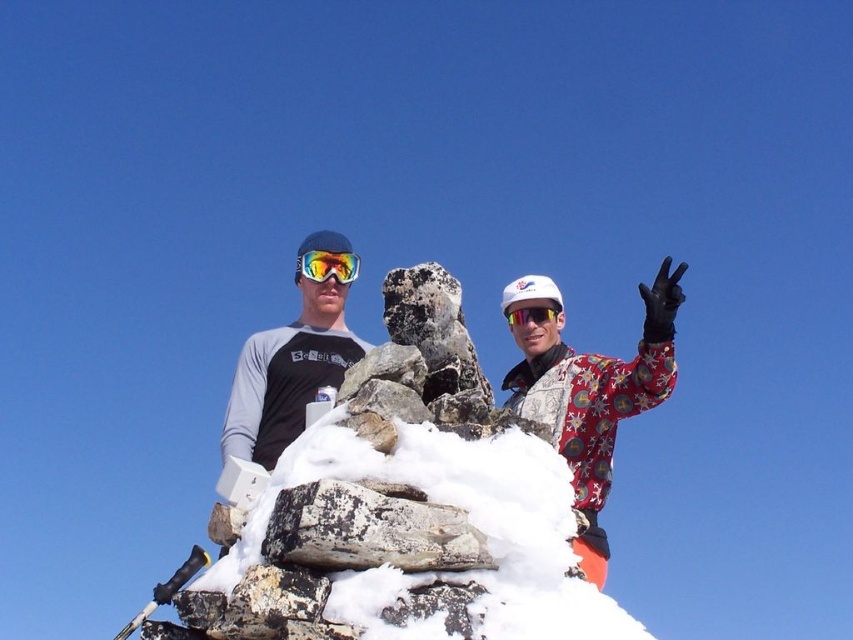
Question: Can you confirm if speckled rock at center is smaller than matte white goggles at center?

Choices:
 (A) yes
 (B) no

Answer: (B)

Question: In this image, where is multicolored reflective goggles at center located relative to matte white goggles at center?

Choices:
 (A) below
 (B) above

Answer: (B)

Question: Which object is positioned farthest from the white fluffy snow at center?

Choices:
 (A) speckled rock at center
 (B) multicolored reflective goggles at center
 (C) fluorescent red snowsuit at center

Answer: (B)

Question: Can you confirm if multicolored reflective goggles at center is thinner than matte white goggles at center?

Choices:
 (A) no
 (B) yes

Answer: (A)

Question: Among these points, which one is farthest from the camera?

Choices:
 (A) (526, 308)
 (B) (339, 376)
 (C) (314, 273)

Answer: (C)

Question: Estimate the real-world distances between objects in this image. Which object is farther from the white fluffy snow at center?

Choices:
 (A) matte black ski goggles at center
 (B) fluorescent red snowsuit at center
 (C) multicolored reflective goggles at center

Answer: (C)